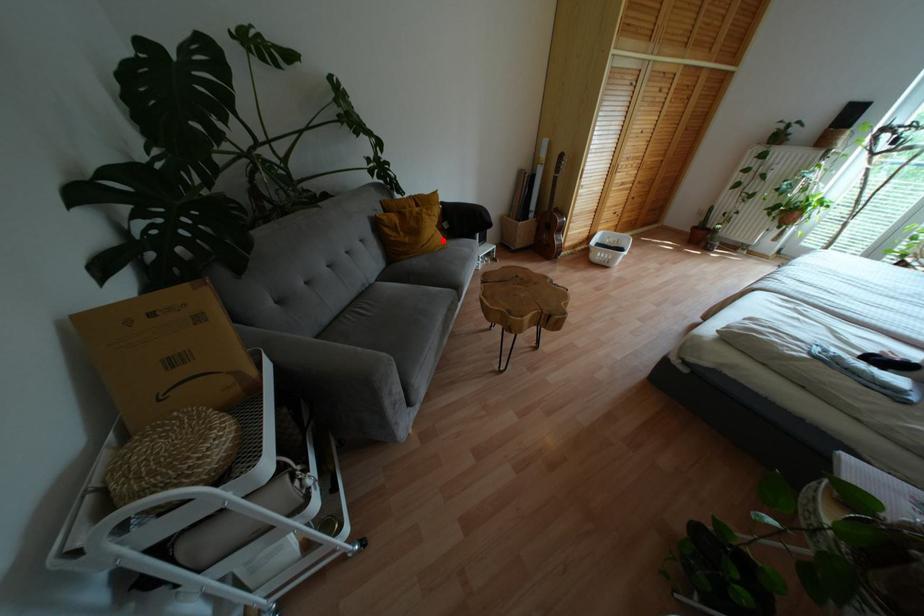
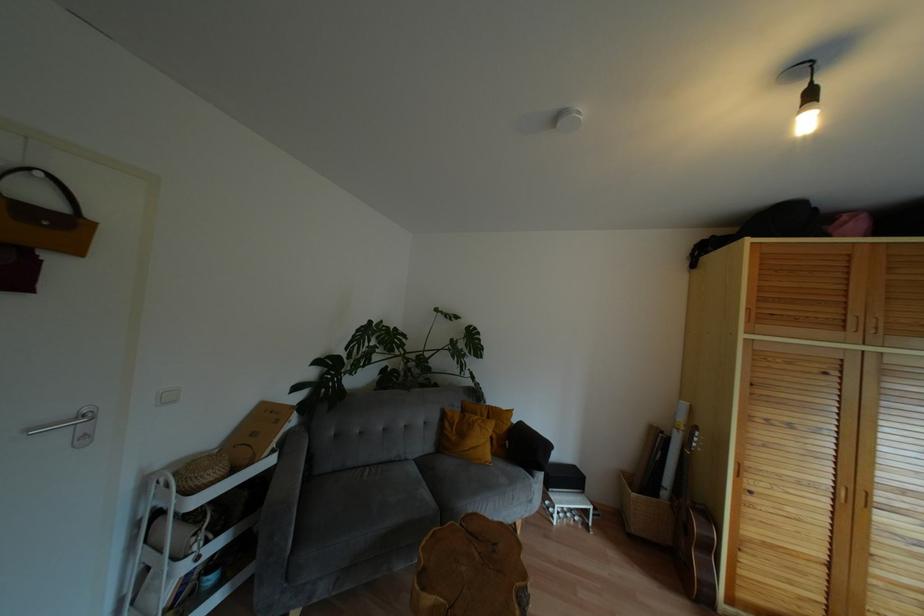
Locate, in the second image, the point that corresponds to the highlighted location in the first image.

(488, 456)